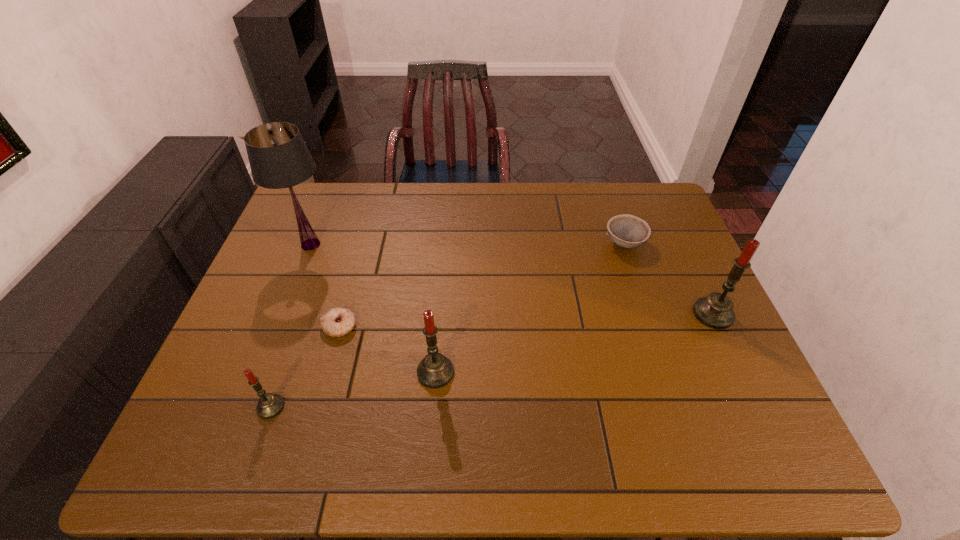
Locate an element on the screen. This screenshot has width=960, height=540. the shortest object is located at coordinates (338, 321).

Locate an element on the screen. Image resolution: width=960 pixels, height=540 pixels. vacant space located on the right of the leftmost candle is located at coordinates (324, 407).

The image size is (960, 540). Find the location of `vacant position located 0.110m on the left of the third tallest object`. vacant position located 0.110m on the left of the third tallest object is located at coordinates (371, 372).

This screenshot has width=960, height=540. I want to click on free spot located 0.330m on the back of the rightmost object, so click(670, 223).

Image resolution: width=960 pixels, height=540 pixels. I want to click on free location located on the front-facing side of the tallest object, so click(x=372, y=245).

Locate an element on the screen. Image resolution: width=960 pixels, height=540 pixels. vacant space located on the front of the bowl is located at coordinates click(x=668, y=370).

The width and height of the screenshot is (960, 540). Find the location of `vacant space situated on the left of the doughnut`. vacant space situated on the left of the doughnut is located at coordinates (295, 326).

This screenshot has height=540, width=960. I want to click on candle at the left edge, so click(269, 405).

Identify the location of lampshade that is positioned at the left edge. (278, 156).

Image resolution: width=960 pixels, height=540 pixels. Find the location of `candle that is at the right edge`. candle that is at the right edge is located at coordinates (716, 311).